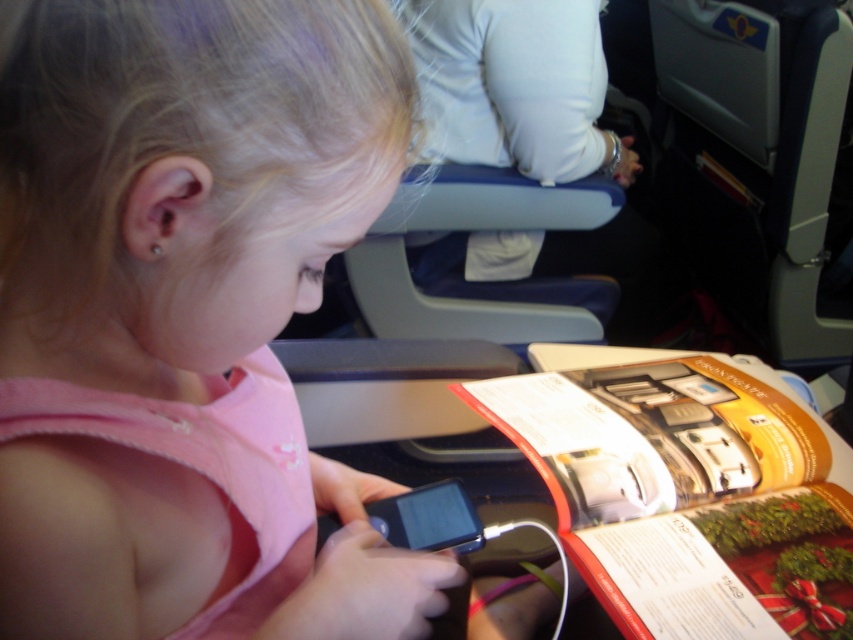
You are a photographer trying to capture a clear photo of the orange glossy magazine at lower right without the pink fabric girl at center blocking it. Since the girl is larger than the magazine, will you need to adjust your camera angle to avoid her?

The pink fabric girl at center is larger than the orange glossy magazine at lower right, so you will need to adjust your camera angle to avoid her blocking the magazine.

You are a photographer taking a picture of the scene. You notice two points in the image, one at point [294,1] and another at point [769,424]. Which point will appear larger in your photo?

Point [294,1] is closer to the camera than point [769,424]. Since objects closer to the camera appear larger in a photo, the point at [294,1] will appear larger in the photo.